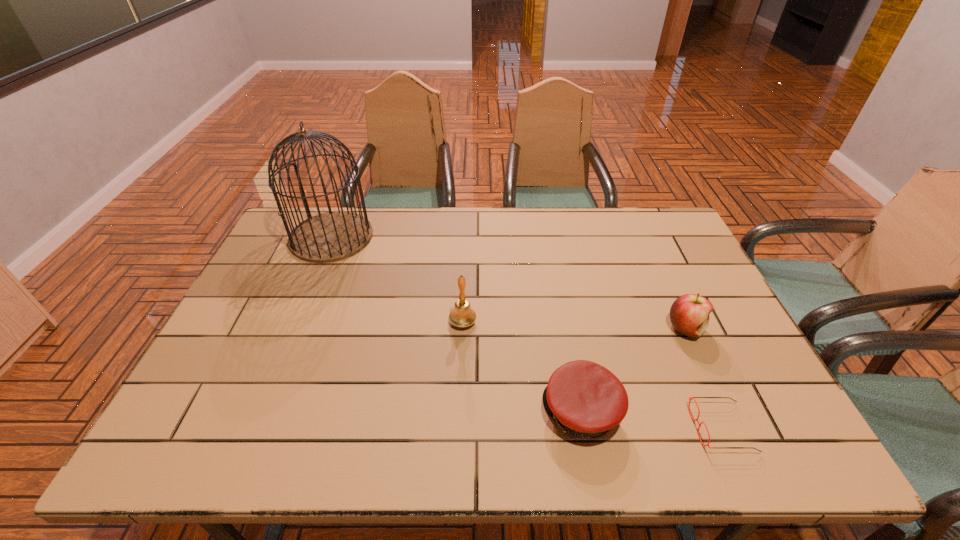
Where is `the tallest object`? The image size is (960, 540). the tallest object is located at coordinates (333, 236).

Locate an element on the screen. Image resolution: width=960 pixels, height=540 pixels. the farthest object is located at coordinates (333, 236).

Locate an element on the screen. The width and height of the screenshot is (960, 540). the second object from left to right is located at coordinates (462, 315).

Find the location of `the second tallest object`. the second tallest object is located at coordinates (462, 315).

Identify the location of the third shortest object. (689, 314).

Identify the location of the second shortest object. (585, 399).

Find the location of a particular element. This screenshot has height=540, width=960. cap is located at coordinates (585, 399).

What are the coordinates of `spectacles` in the screenshot? It's located at (689, 397).

This screenshot has height=540, width=960. Identify the location of vacant region located 0.150m at the door of the birdcage. (306, 297).

Identify the location of blank area located on the front of the second object from left to right. (462, 347).